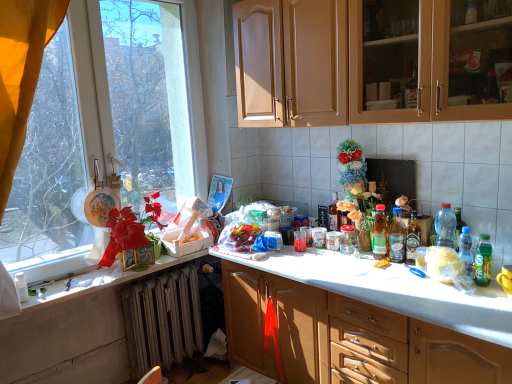
This screenshot has height=384, width=512. In order to click on vacant area situated to the left side of green matte bottle at right, acting as the 6th bottle starting from the back in this screenshot , I will do pos(447,288).